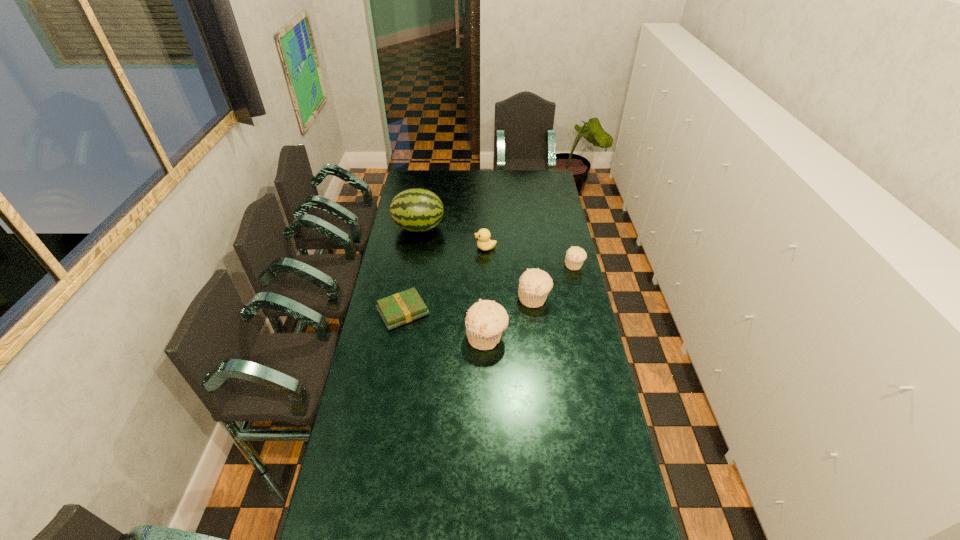
Locate an element on the screen. the leftmost muffin is located at coordinates (485, 321).

Where is `the second nearest muffin`? the second nearest muffin is located at coordinates (534, 284).

Find the location of a particular element. The width and height of the screenshot is (960, 540). the second muffin from right to left is located at coordinates (534, 284).

The image size is (960, 540). Find the location of `the rightmost object`. the rightmost object is located at coordinates (575, 256).

Locate an element on the screen. The width and height of the screenshot is (960, 540). the third farthest object is located at coordinates pyautogui.click(x=575, y=256).

Where is `the fifth nearest object`? This screenshot has height=540, width=960. the fifth nearest object is located at coordinates (484, 243).

Find the location of a particular element. This screenshot has width=960, height=540. watermelon is located at coordinates (416, 210).

Identify the location of the farthest object. The width and height of the screenshot is (960, 540). (416, 210).

What are the coordinates of `book` in the screenshot? It's located at (401, 308).

Identify the location of vacant space situated on the front of the nearest muffin. (487, 375).